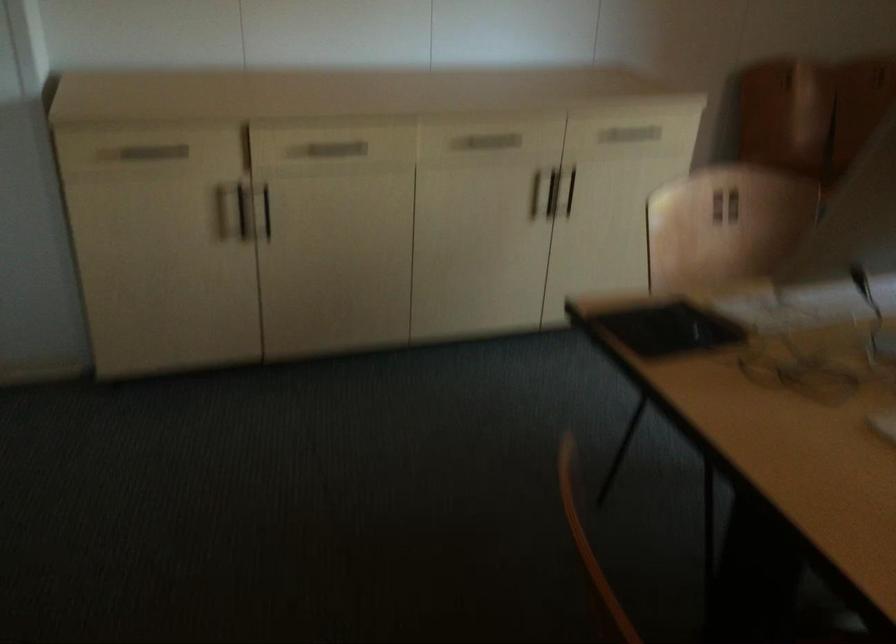
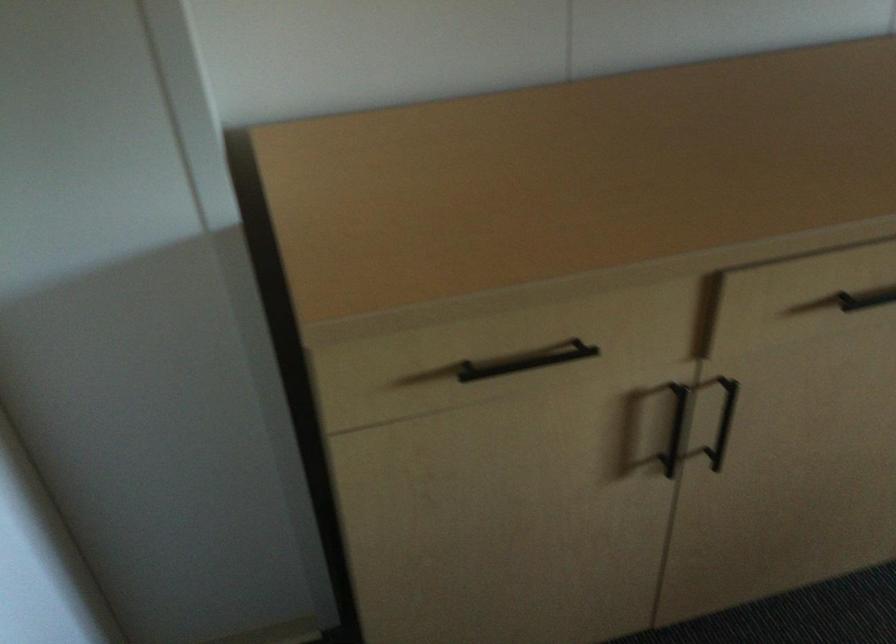
The point at (243,212) is marked in the first image. Where is the corresponding point in the second image?

(675, 428)